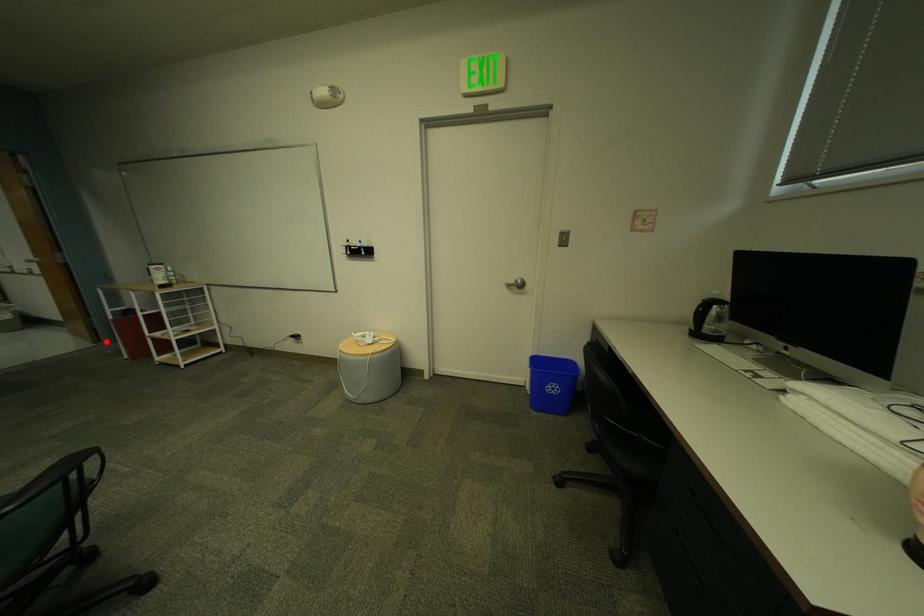
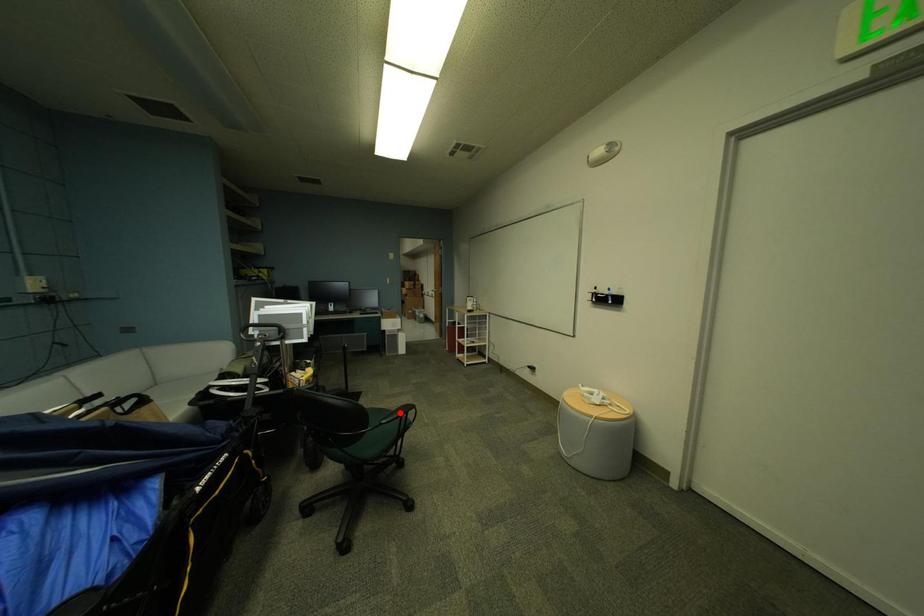
I am providing you with two images of the same scene from different viewpoints. A red point is marked on the first image and another point is marked on the second image. Does the point marked in image1 correspond to the same location as the one in image2?

No